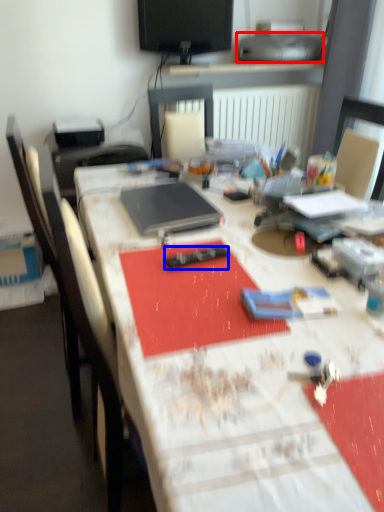
Question: Which of the following is the closest to the observer, printer (highlighted by a red box) or remote control (highlighted by a blue box)?

Choices:
 (A) printer
 (B) remote control

Answer: (B)